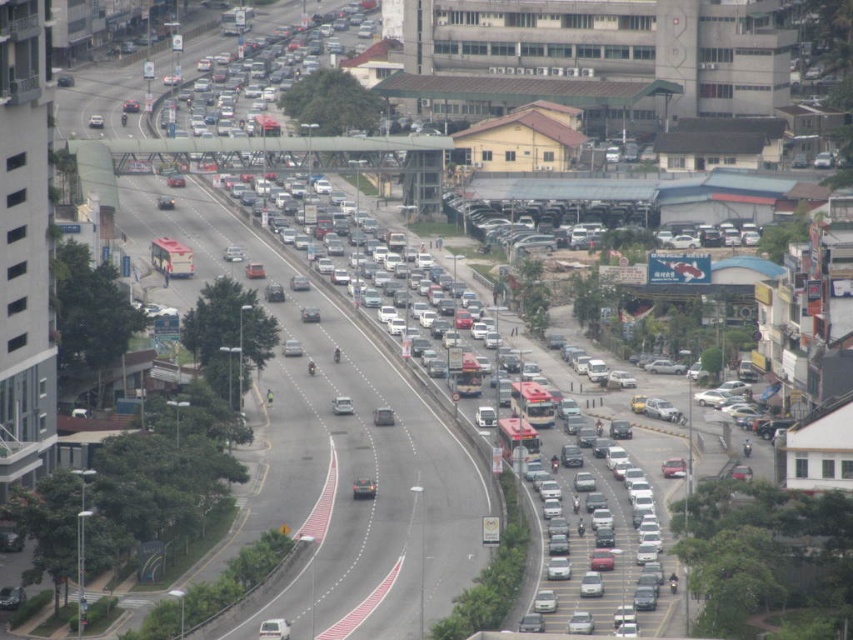
Question: Which of the following is the farthest from the observer?

Choices:
 (A) matte black car at center
 (B) silver metallic car at center
 (C) matte silver car at center
 (D) metallic gray highway at center

Answer: (B)

Question: Estimate the real-world distances between objects in this image. Which object is farther from the matte silver car at center?

Choices:
 (A) silver metallic car at center
 (B) matte black car at center
 (C) metallic gray highway at center

Answer: (C)

Question: Considering the relative positions of matte silver car at center and matte black car at center in the image provided, where is matte silver car at center located with respect to matte black car at center?

Choices:
 (A) below
 (B) above

Answer: (A)

Question: Does metallic gray highway at center have a smaller size compared to silver metallic car at center?

Choices:
 (A) yes
 (B) no

Answer: (B)

Question: From the image, what is the correct spatial relationship of metallic gray highway at center in relation to matte silver car at center?

Choices:
 (A) right
 (B) left

Answer: (B)

Question: Which point is closer to the camera?

Choices:
 (A) silver metallic car at center
 (B) metallic gray highway at center
 (C) matte black car at center

Answer: (B)